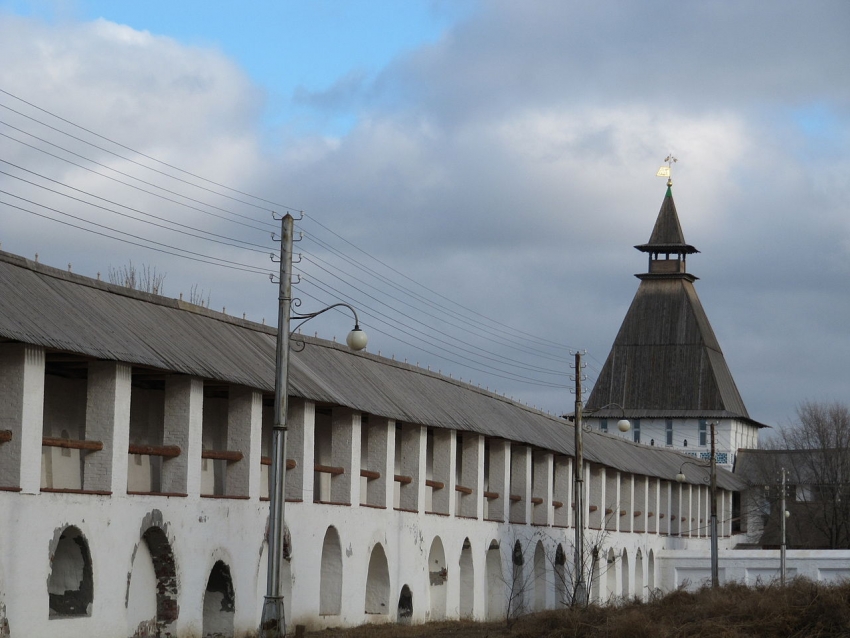
This screenshot has width=850, height=638. Identify the location of wooden railing. (75, 441), (149, 446), (218, 452), (332, 466), (365, 471), (400, 476), (434, 482).